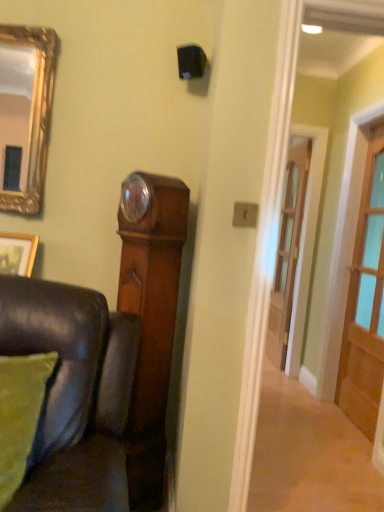
Question: Would you say wooden door at center, the 1th door positioned from the back, is to the left or to the right of wooden door at right, the first door positioned from the front, in the picture?

Choices:
 (A) right
 (B) left

Answer: (B)

Question: From their relative heights in the image, would you say wooden door at center, arranged as the 1th door when viewed from the left, is taller or shorter than wooden door at right, acting as the 2th door starting from the back?

Choices:
 (A) tall
 (B) short

Answer: (B)

Question: Considering the real-world distances, which object is closest to the wooden door at center, arranged as the 1th door when viewed from the left?

Choices:
 (A) wooden picture frame at lower left
 (B) green fabric pillow at lower left
 (C) wooden door at right, which is counted as the 2th door, starting from the left

Answer: (C)

Question: Considering the real-world distances, which object is farthest from the wooden door at right, the first door positioned from the front?

Choices:
 (A) green fabric pillow at lower left
 (B) wooden picture frame at lower left
 (C) wooden door at center, the 2th door viewed from the right

Answer: (A)